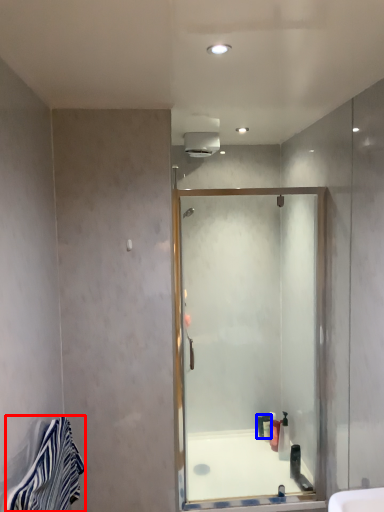
Question: Which point is closer to the camera, material (highlighted by a red box) or toiletry (highlighted by a blue box)?

Choices:
 (A) material
 (B) toiletry

Answer: (A)